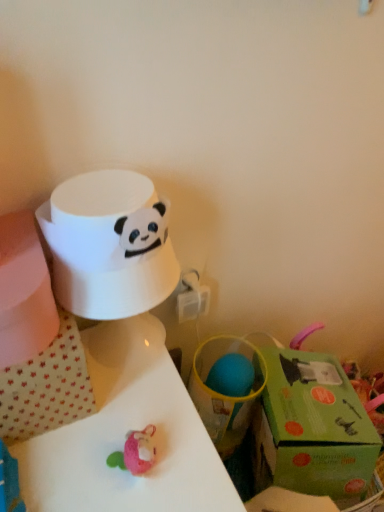
Where is `vacant location below white matte paper towel at upper left (from a real-world perspective)`? The width and height of the screenshot is (384, 512). vacant location below white matte paper towel at upper left (from a real-world perspective) is located at coordinates (129, 343).